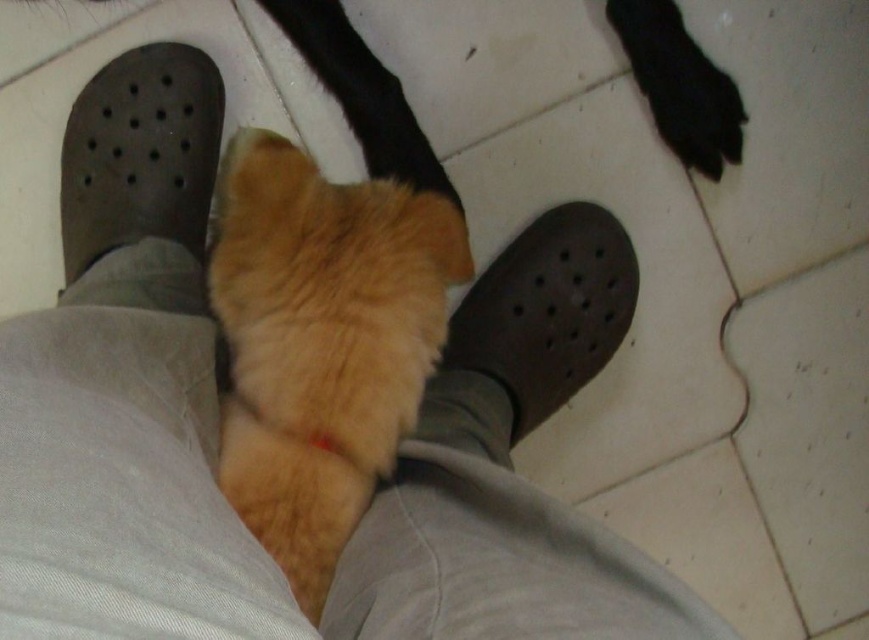
Question: Does fuzzy orange cat at center have a greater width compared to brown rubber shoe at center?

Choices:
 (A) yes
 (B) no

Answer: (A)

Question: Observing the image, what is the correct spatial positioning of fuzzy orange cat at center in reference to dark grey rubber shoe at left?

Choices:
 (A) left
 (B) right

Answer: (B)

Question: Which of the following is the closest to the observer?

Choices:
 (A) dark grey rubber shoe at left
 (B) brown rubber shoe at center

Answer: (B)

Question: Which object appears farthest from the camera in this image?

Choices:
 (A) fuzzy orange cat at center
 (B) brown rubber shoe at center
 (C) dark grey rubber shoe at left

Answer: (C)

Question: Is fuzzy orange cat at center positioned before brown rubber shoe at center?

Choices:
 (A) yes
 (B) no

Answer: (A)

Question: Which object appears farthest from the camera in this image?

Choices:
 (A) fuzzy orange cat at center
 (B) brown rubber shoe at center

Answer: (B)